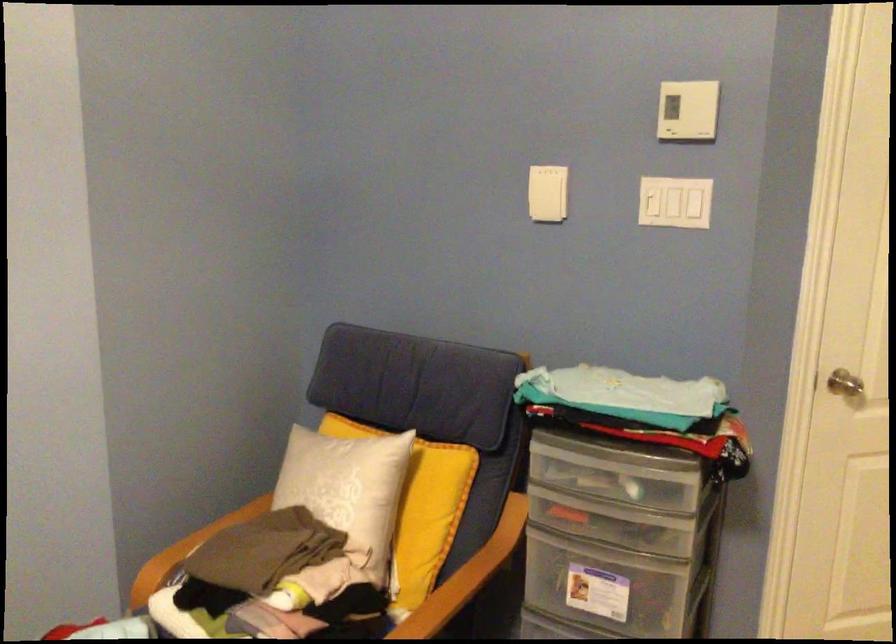
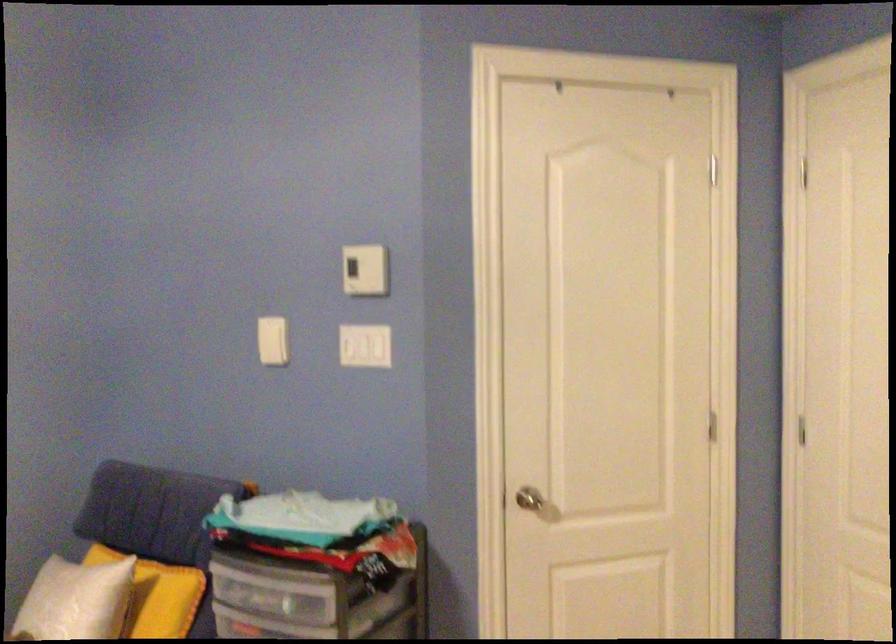
Find the pixel in the second image that matches point 553,190 in the first image.

(272, 341)